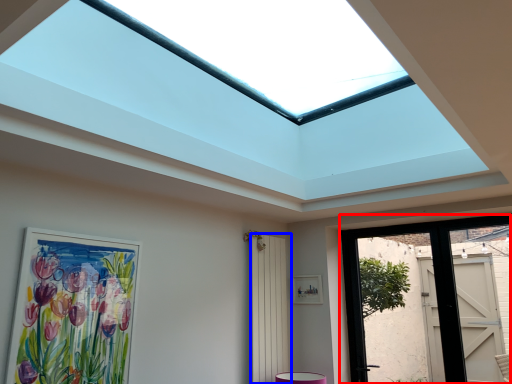
Question: Which of the following is the farthest to the observer, door (highlighted by a red box) or screen door (highlighted by a blue box)?

Choices:
 (A) door
 (B) screen door

Answer: (B)